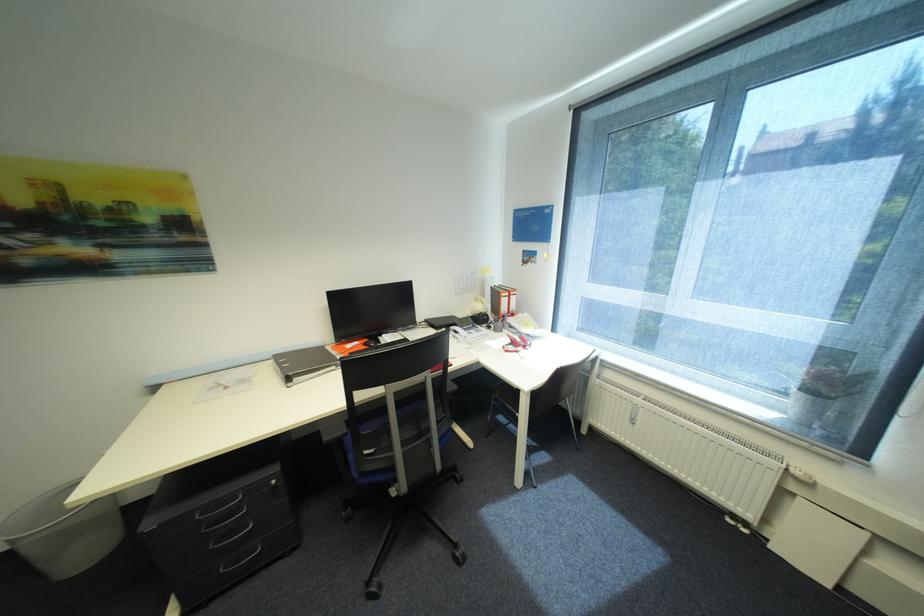
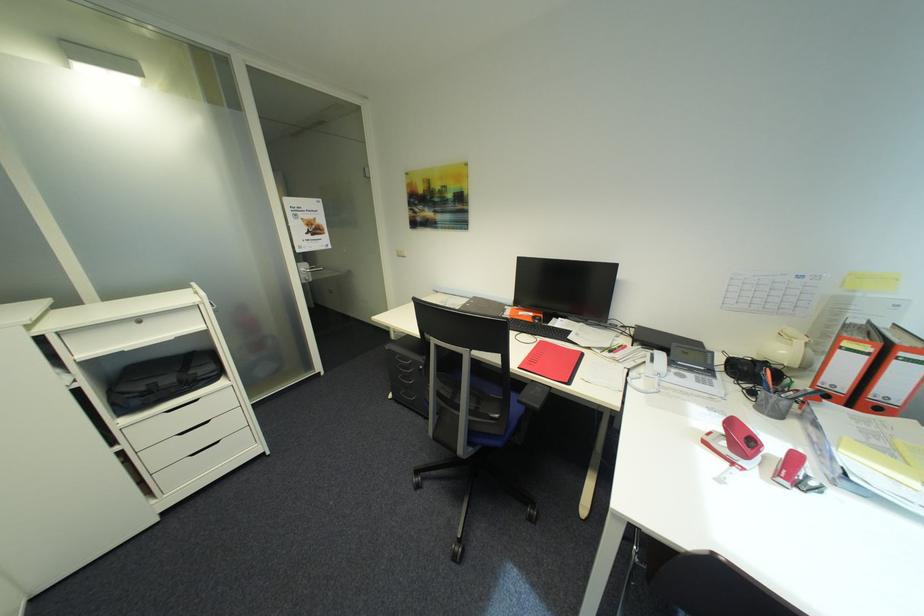
Find the pixel in the second image that matches point (222, 546) in the first image.

(408, 378)